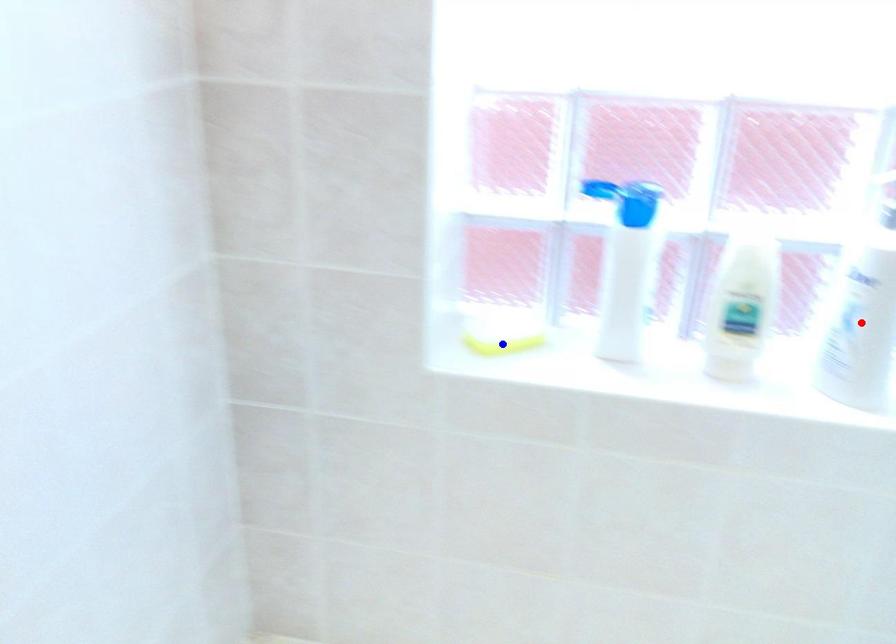
Question: In the image, two points are highlighted. Which point is nearer to the camera? Reply with the corresponding letter.

Choices:
 (A) blue point
 (B) red point

Answer: (B)